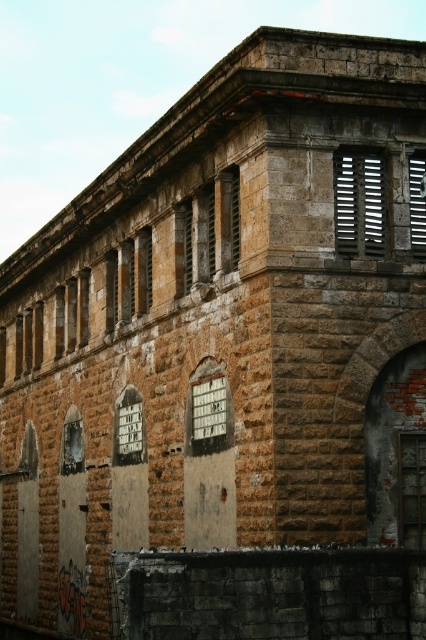
You are a maintenance worker tasked with repairing two windows in this building. You have a ladder that can reach up to 20 meters. The white plastic window at center and the clear glass window at lower left are both in need of repair. Can your ladder reach both windows if you place it at the base of the building between them?

The distance between the white plastic window at center and the clear glass window at lower left is 19.36 meters. Since your ladder can reach up to 20 meters, placing it between them would allow you to reach both windows as the maximum distance between them is within the ladder length.

You are an architect inspecting the building. You need to replace the clear glass window at lower left and the matte metal slats at upper right. Which one requires a larger replacement material?

The matte metal slats at upper right requires a larger replacement material since it is larger in size than the clear glass window at lower left.

You are standing in front of an old stone building and notice a point marked at coordinates (129, 429). Based on the scene description, what object is located at this point?

The point at (129, 429) indicates a white painted wood window at center.